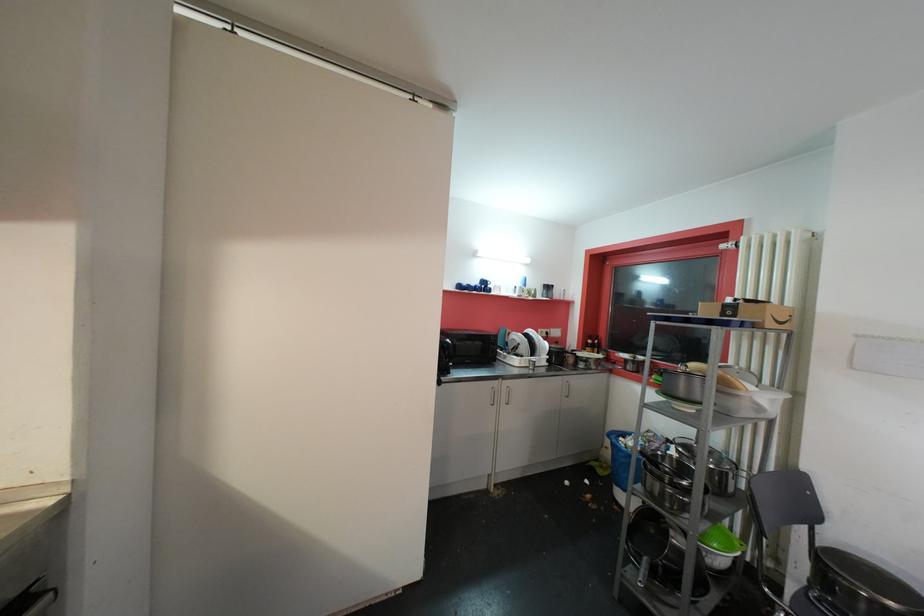
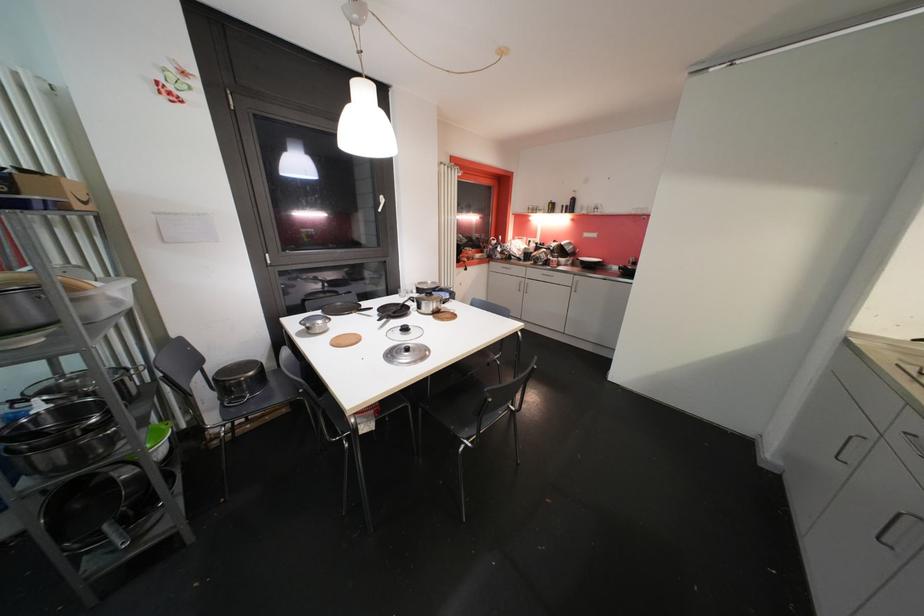
The point at [650,561] is marked in the first image. Where is the corresponding point in the second image?

(111, 529)